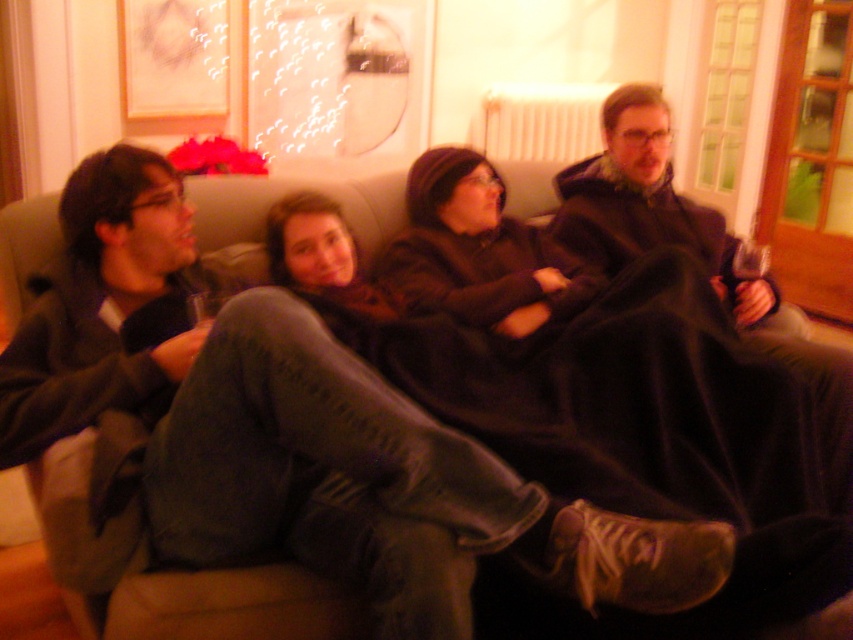
Question: Which point is closer to the camera taking this photo?

Choices:
 (A) (53, 476)
 (B) (643, 216)

Answer: (A)

Question: Is dark gray hoodie at center further to the viewer compared to dark brown fleece blanket at right?

Choices:
 (A) no
 (B) yes

Answer: (A)

Question: Is dark gray hoodie at center closer to camera compared to dark brown fleece blanket at right?

Choices:
 (A) yes
 (B) no

Answer: (A)

Question: Does dark gray hoodie at center come behind dark brown fleece blanket at right?

Choices:
 (A) yes
 (B) no

Answer: (B)